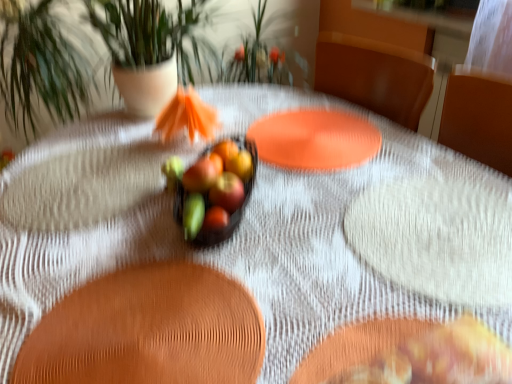
Locate an element on the screen. vacant area that lies in front of glossy red apple at center, which is the second fruit from left to right is located at coordinates (218, 303).